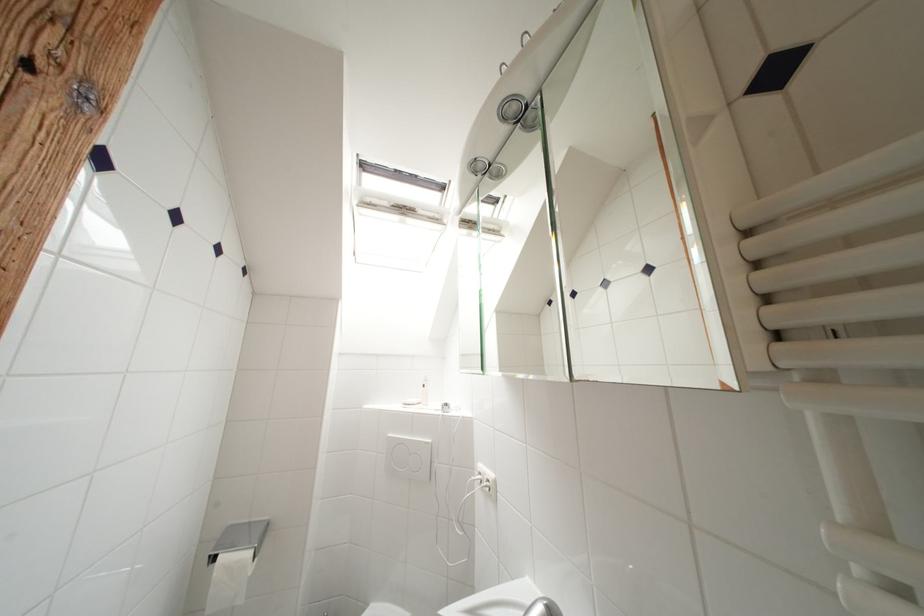
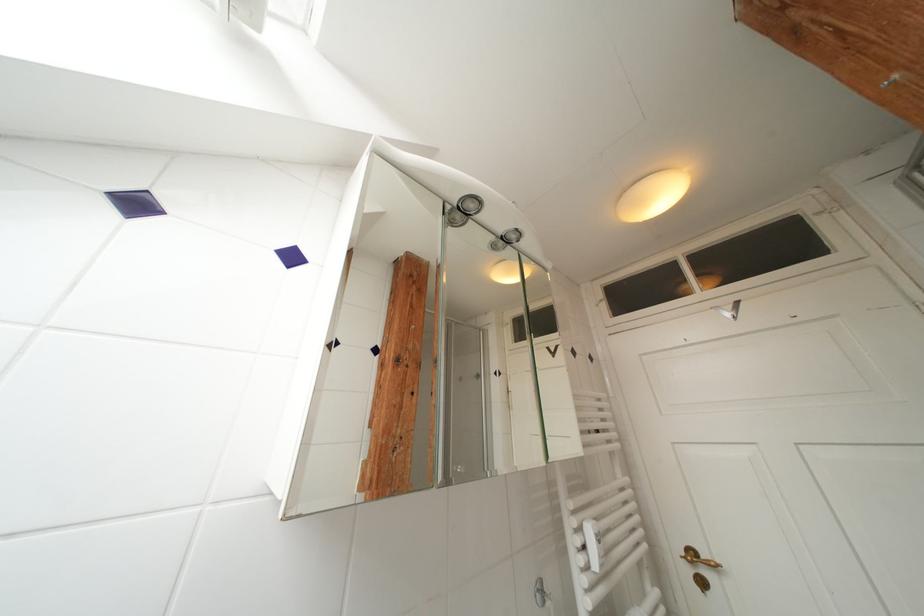
First-person continuous shooting, in which direction is the camera rotating?

The camera rotated toward right-up.